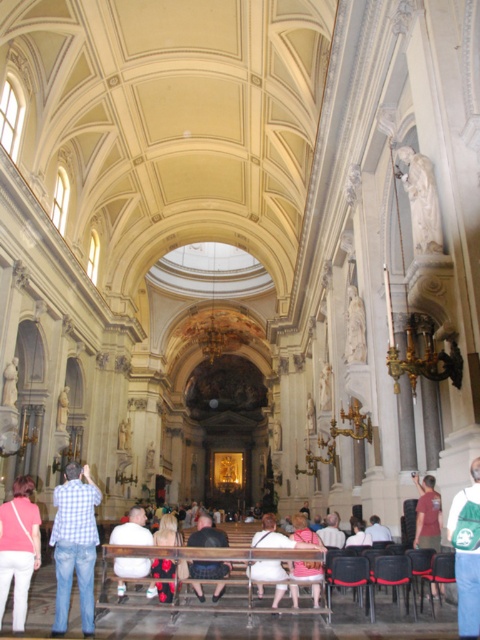
You are standing in the grand church and want to move from the point at coordinates point (465, 497) to the point at coordinates point (131, 529). According to the image, which direction should you move to reach your destination?

You should move forward because point (465, 497) is in front of point (131, 529), so moving forward from point (465, 497) will lead you towards point (131, 529).